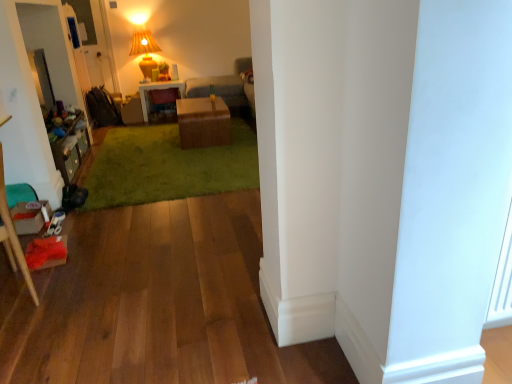
Question: Is the depth of brown cardboard box at center greater than that of green plush carpet at center?

Choices:
 (A) yes
 (B) no

Answer: (A)

Question: Does brown cardboard box at center come in front of green plush carpet at center?

Choices:
 (A) no
 (B) yes

Answer: (A)

Question: Can you confirm if brown cardboard box at center is shorter than green plush carpet at center?

Choices:
 (A) yes
 (B) no

Answer: (B)

Question: Does brown cardboard box at center contain green plush carpet at center?

Choices:
 (A) yes
 (B) no

Answer: (B)

Question: From the image's perspective, would you say brown cardboard box at center is shown under green plush carpet at center?

Choices:
 (A) yes
 (B) no

Answer: (B)

Question: From the image's perspective, is matte yellow fabric lampshade at upper center above or below wooden stool at left?

Choices:
 (A) below
 (B) above

Answer: (B)

Question: Considering the positions of matte yellow fabric lampshade at upper center and wooden stool at left in the image, is matte yellow fabric lampshade at upper center wider or thinner than wooden stool at left?

Choices:
 (A) thin
 (B) wide

Answer: (B)

Question: Is matte yellow fabric lampshade at upper center taller or shorter than wooden stool at left?

Choices:
 (A) short
 (B) tall

Answer: (A)

Question: In terms of size, does matte yellow fabric lampshade at upper center appear bigger or smaller than wooden stool at left?

Choices:
 (A) big
 (B) small

Answer: (B)

Question: Does point (240, 72) appear closer or farther from the camera than point (227, 150)?

Choices:
 (A) closer
 (B) farther

Answer: (B)

Question: Is gray fabric couch at center in front of or behind green plush carpet at center in the image?

Choices:
 (A) behind
 (B) front

Answer: (A)

Question: From the image's perspective, is gray fabric couch at center positioned above or below green plush carpet at center?

Choices:
 (A) above
 (B) below

Answer: (A)

Question: Which is correct: gray fabric couch at center is inside green plush carpet at center, or outside of it?

Choices:
 (A) outside
 (B) inside

Answer: (A)

Question: Does point (142, 112) appear closer or farther from the camera than point (25, 274)?

Choices:
 (A) closer
 (B) farther

Answer: (B)

Question: Considering the positions of matte brown desk at center and wooden stool at left in the image, is matte brown desk at center wider or thinner than wooden stool at left?

Choices:
 (A) thin
 (B) wide

Answer: (B)